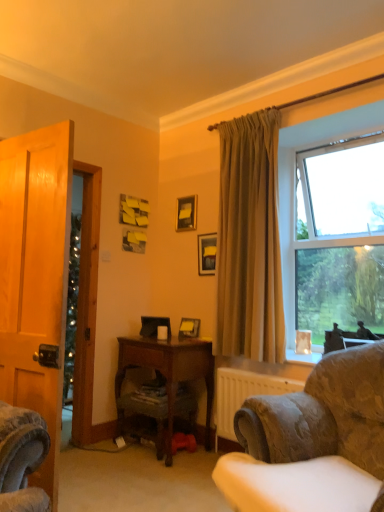
Question: Is matte black picture frame at upper center, which ranks as the second picture frame in bottom-to-top order, positioned behind matte black picture frame at upper center, which appears as the 3th picture frame when ordered from the bottom?

Choices:
 (A) no
 (B) yes

Answer: (A)

Question: Can you confirm if matte black picture frame at upper center, positioned as the 2th picture frame in top-to-bottom order, is bigger than matte black picture frame at upper center, which appears as the 3th picture frame when ordered from the bottom?

Choices:
 (A) yes
 (B) no

Answer: (A)

Question: Is matte black picture frame at upper center, positioned as the 2th picture frame in top-to-bottom order, to the left of matte black picture frame at upper center, which appears as the 3th picture frame when ordered from the bottom, from the viewer's perspective?

Choices:
 (A) yes
 (B) no

Answer: (B)

Question: Would you say matte black picture frame at upper center, positioned as the 2th picture frame in top-to-bottom order, contains matte black picture frame at upper center, which appears as the 3th picture frame when ordered from the bottom?

Choices:
 (A) yes
 (B) no

Answer: (B)

Question: Is matte black picture frame at upper center, positioned as the 2th picture frame in top-to-bottom order, turned away from matte black picture frame at upper center, marked as the 1th picture frame in a top-to-bottom arrangement?

Choices:
 (A) yes
 (B) no

Answer: (B)

Question: From the image's perspective, is matte black picture frame at upper center, which ranks as the second picture frame in bottom-to-top order, located above or below clear glass window at upper right?

Choices:
 (A) below
 (B) above

Answer: (A)

Question: Considering the positions of matte black picture frame at upper center, which ranks as the second picture frame in bottom-to-top order, and clear glass window at upper right in the image, is matte black picture frame at upper center, which ranks as the second picture frame in bottom-to-top order, wider or thinner than clear glass window at upper right?

Choices:
 (A) wide
 (B) thin

Answer: (B)

Question: From their relative heights in the image, would you say matte black picture frame at upper center, which ranks as the second picture frame in bottom-to-top order, is taller or shorter than clear glass window at upper right?

Choices:
 (A) tall
 (B) short

Answer: (B)

Question: Is matte black picture frame at upper center, positioned as the 2th picture frame in top-to-bottom order, inside or outside of clear glass window at upper right?

Choices:
 (A) inside
 (B) outside

Answer: (B)

Question: Relative to wooden desk at center, is matte white coffee cup at center in front or behind?

Choices:
 (A) front
 (B) behind

Answer: (B)

Question: From the image's perspective, is matte white coffee cup at center above or below wooden desk at center?

Choices:
 (A) below
 (B) above

Answer: (B)

Question: Would you say matte white coffee cup at center is inside or outside wooden desk at center?

Choices:
 (A) inside
 (B) outside

Answer: (B)

Question: From their relative heights in the image, would you say matte white coffee cup at center is taller or shorter than wooden desk at center?

Choices:
 (A) tall
 (B) short

Answer: (B)

Question: From a real-world perspective, relative to matte black picture frame at upper center, which appears as the 3th picture frame when ordered from the bottom, is beige fabric curtain at upper right vertically above or below?

Choices:
 (A) below
 (B) above

Answer: (A)

Question: From the image's perspective, relative to matte black picture frame at upper center, which appears as the 3th picture frame when ordered from the bottom, is beige fabric curtain at upper right above or below?

Choices:
 (A) above
 (B) below

Answer: (B)